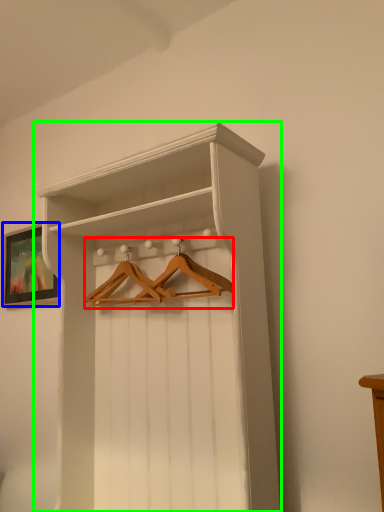
Question: Which is farther away from hanger (highlighted by a red box)? picture frame (highlighted by a blue box) or shelf (highlighted by a green box)?

Choices:
 (A) picture frame
 (B) shelf

Answer: (A)